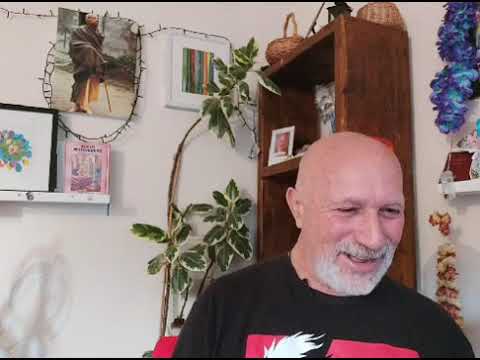
The width and height of the screenshot is (480, 360). In order to click on pink book in this screenshot , I will do `click(108, 158)`.